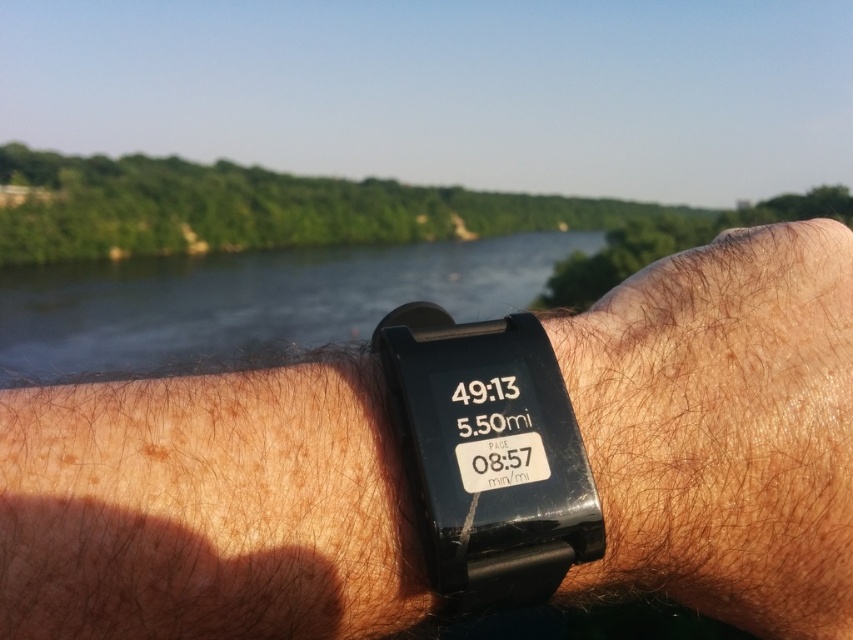
How far apart are black matte watch at center and brown hairy skin at center?

A distance of 1.02 inches exists between black matte watch at center and brown hairy skin at center.

Is black matte watch at center smaller than brown hairy skin at center?

Incorrect, black matte watch at center is not smaller in size than brown hairy skin at center.

What are the coordinates of `black matte watch at center` in the screenshot? It's located at (206, 508).

Is the position of black matte watch at center less distant than that of dark blue water at center?

Yes.

Who is lower down, black matte watch at center or dark blue water at center?

black matte watch at center is lower down.

Does point (65, 410) lie in front of point (180, 342)?

Yes.

This screenshot has width=853, height=640. What are the coordinates of `black matte watch at center` in the screenshot? It's located at (206, 508).

Which is in front, point (712, 362) or point (131, 365)?

Point (712, 362) is in front.

The height and width of the screenshot is (640, 853). Find the location of `brown hairy skin at center`. brown hairy skin at center is located at coordinates (724, 428).